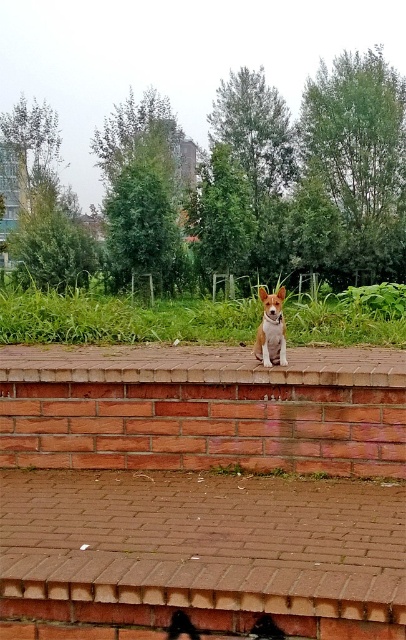
Does brick at center come in front of brown fur dog at center?

Yes, it is.

Consider the image. Measure the distance from brick at center to brown fur dog at center.

35.41 inches

What do you see at coordinates (202, 364) in the screenshot? I see `brick at center` at bounding box center [202, 364].

You are a GUI agent. You are given a task and a screenshot of the screen. Output one action in this format:
    pyautogui.click(x=<x>, y=<y>)
    Task: Click on the brick at center
    Image resolution: width=406 pixels, height=640 pixels.
    Given the screenshot: What is the action you would take?
    pyautogui.click(x=202, y=364)